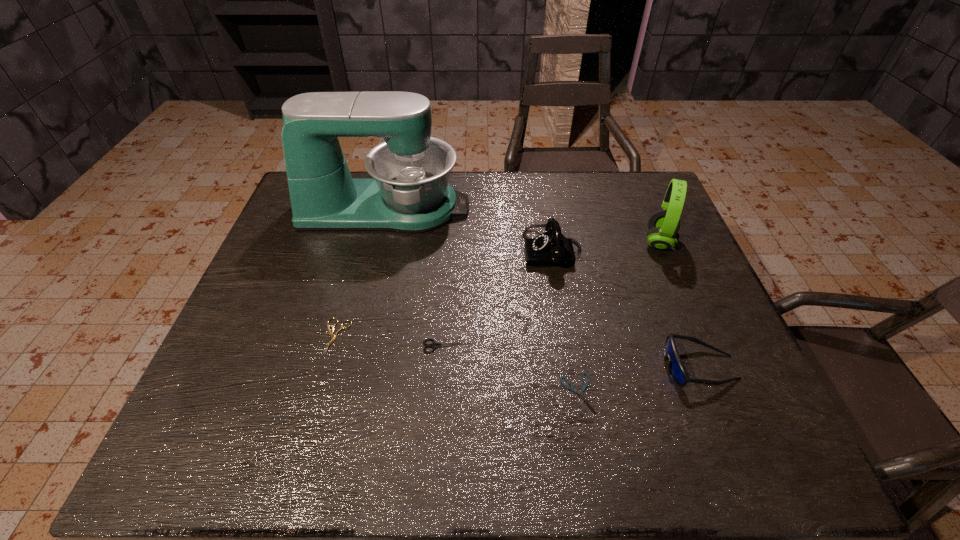
Identify the location of blank area located 0.310m on the front-facing side of the mixer. (569, 208).

Locate an element on the screen. The height and width of the screenshot is (540, 960). vacant region located on the left of the headset is located at coordinates (525, 241).

In order to click on free region located 0.400m on the dial of the telephone in this screenshot , I will do `click(380, 251)`.

Identify the location of vacant position located on the dial of the telephone. This screenshot has height=540, width=960. pyautogui.click(x=413, y=251).

Locate an element on the screen. The height and width of the screenshot is (540, 960). vacant space positioned 0.220m on the dial of the telephone is located at coordinates (444, 251).

Where is `vacant area situated 0.140m on the front-facing side of the fourth tallest object`? The image size is (960, 540). vacant area situated 0.140m on the front-facing side of the fourth tallest object is located at coordinates (599, 367).

Where is `vacant space located 0.100m on the front-facing side of the fourth tallest object`? vacant space located 0.100m on the front-facing side of the fourth tallest object is located at coordinates 617,367.

Identify the location of vacant region located 0.280m on the front-facing side of the fourth tallest object. (535, 367).

What are the coordinates of `free region located 0.220m on the right of the tallest shears` in the screenshot? It's located at (567, 346).

The width and height of the screenshot is (960, 540). Identify the location of vacant area situated on the right of the second shortest shears. (504, 338).